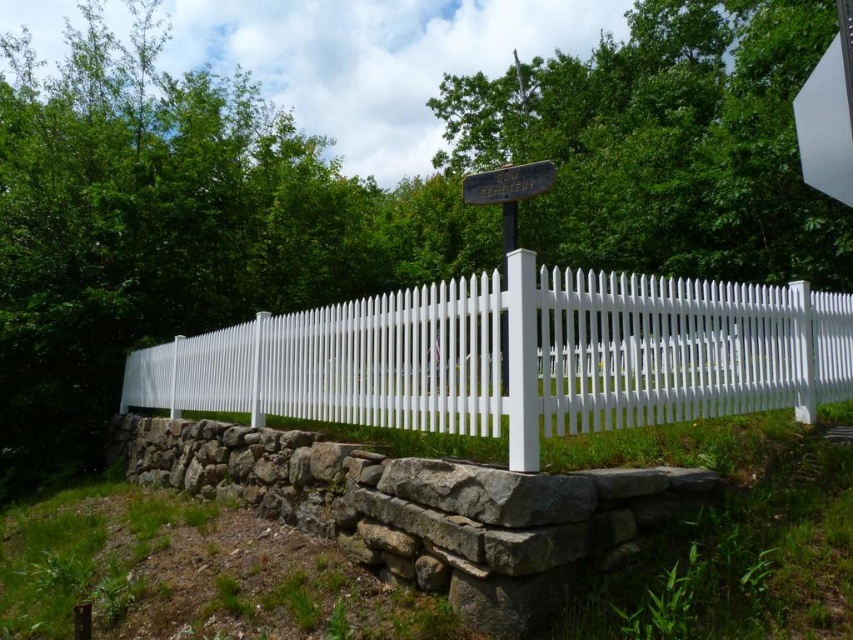
Question: Estimate the real-world distances between objects in this image. Which object is closer to the wooden signpost at center?

Choices:
 (A) white wooden post at center
 (B) white painted wood picket fence at center

Answer: (A)

Question: Which point appears closest to the camera in this image?

Choices:
 (A) (498, 170)
 (B) (514, 205)

Answer: (B)

Question: Can you confirm if white painted wood picket fence at center is wider than white wooden post at center?

Choices:
 (A) yes
 (B) no

Answer: (B)

Question: Which of the following is the closest to the observer?

Choices:
 (A) white wooden post at center
 (B) wooden signpost at center
 (C) white smooth post at center

Answer: (C)

Question: Does white smooth post at center appear on the right side of white wooden post at center?

Choices:
 (A) no
 (B) yes

Answer: (A)

Question: Can you confirm if white smooth post at center is thinner than white wooden post at center?

Choices:
 (A) no
 (B) yes

Answer: (B)